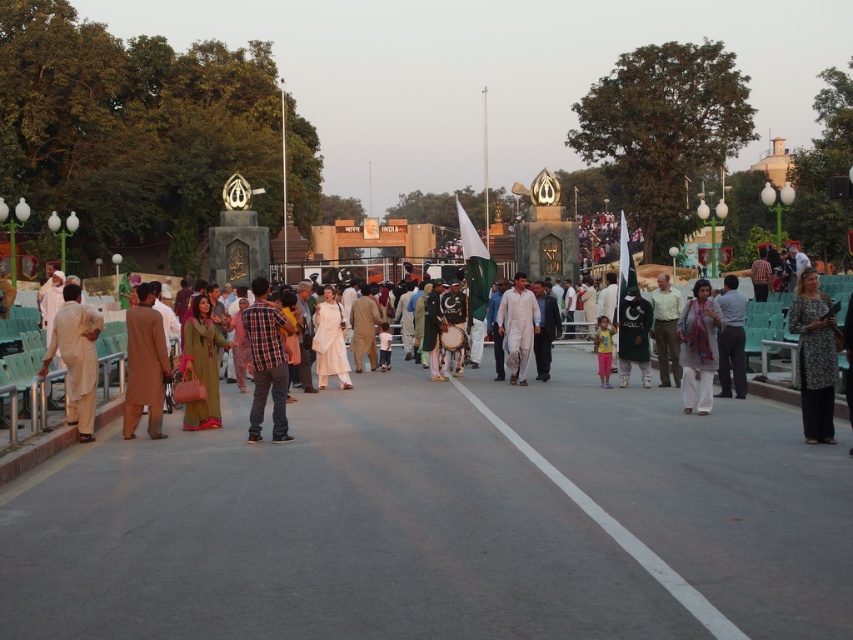
Question: Which point is farther to the camera?

Choices:
 (A) (251, 282)
 (B) (735, 314)

Answer: (A)

Question: Estimate the real-world distances between objects in this image. Which object is closer to the brown woolen suit at left?

Choices:
 (A) white cotton kurta at center
 (B) light brown fabric dress at center
 (C) white silk dress at center

Answer: (C)

Question: Is light brown fabric dress at center wider than light beige fabric at left?

Choices:
 (A) no
 (B) yes

Answer: (B)

Question: Is light beige fabric at left positioned before light green fabric shirt at center?

Choices:
 (A) no
 (B) yes

Answer: (B)

Question: Based on their relative distances, which object is farther from the light green fabric shirt at center?

Choices:
 (A) white cotton kurta at center
 (B) light brown fabric dress at center
 (C) matte pink dress at center

Answer: (C)

Question: Is light brown fabric dress at center bigger than light beige fabric at left?

Choices:
 (A) no
 (B) yes

Answer: (B)